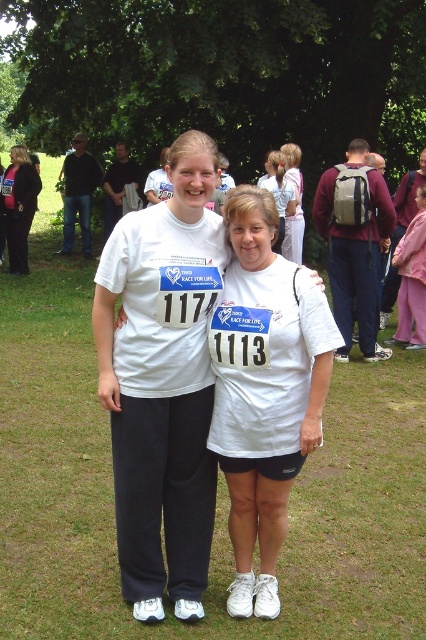
You are organizing a photo shoot for a clothing brand and need to ensure that the pink fabric coat at right and the black fabric pants at left are visible in the frame. Based on their sizes, which item might require more strategic placement to ensure it doesn not get lost in the background?

The pink fabric coat at right occupies less space than the black fabric pants at left, so the pink fabric coat at right might require more strategic placement to ensure it doesn not get lost in the background.

You are a photographer at the Tesco Race for Life event. You need to position yourself so that the pink fabric coat at right and the black fabric pants at left are both in frame. Based on their positions, which object should be placed on the right side of your camera frame?

The pink fabric coat at right should be placed on the right side of your camera frame because it is located to the right of the black fabric pants at left.

You are a photographer at the Tesco Race for Life event. You need to capture a photo of the pink fabric coat at right and the black fabric pants at left. Based on their positions, which object is lower in the image?

The pink fabric coat at right is below the black fabric pants at left, so the pink fabric coat at right is lower in the image.